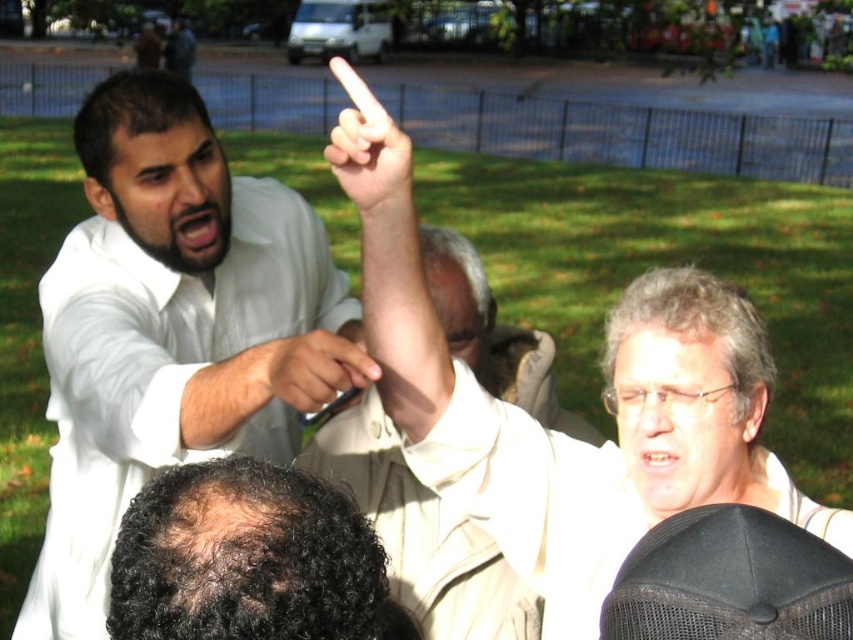
You are a photographer at the event and want to capture a photo that includes both the white matte shirt at upper left and the smooth skin finger at upper center. Which object should you focus on first to ensure both are in frame?

You should focus on the white matte shirt at upper left first because it is taller than the smooth skin finger at upper center, so positioning the camera to include its full height will naturally include the smaller finger in the frame.